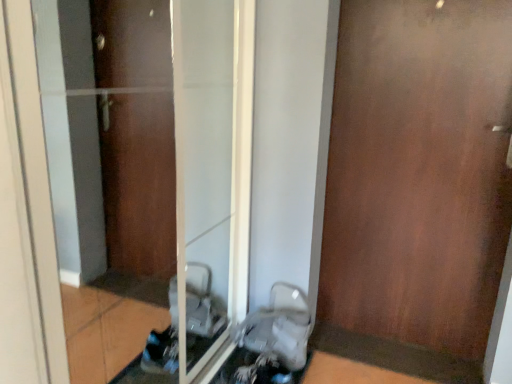
Question: Is the depth of transparent glass door at center greater than that of white plastic baby carriage at lower center?

Choices:
 (A) yes
 (B) no

Answer: (B)

Question: Does transparent glass door at center appear on the left side of white plastic baby carriage at lower center?

Choices:
 (A) yes
 (B) no

Answer: (A)

Question: Would you consider transparent glass door at center to be distant from white plastic baby carriage at lower center?

Choices:
 (A) no
 (B) yes

Answer: (A)

Question: Is transparent glass door at center bigger than white plastic baby carriage at lower center?

Choices:
 (A) yes
 (B) no

Answer: (A)

Question: Is transparent glass door at center facing away from white plastic baby carriage at lower center?

Choices:
 (A) no
 (B) yes

Answer: (B)

Question: From the image's perspective, relative to white plastic baby carriage at lower center, is transparent glass door at center above or below?

Choices:
 (A) below
 (B) above

Answer: (B)

Question: Is transparent glass door at center taller or shorter than white plastic baby carriage at lower center?

Choices:
 (A) tall
 (B) short

Answer: (A)

Question: Based on their positions, is transparent glass door at center located to the left or right of white plastic baby carriage at lower center?

Choices:
 (A) left
 (B) right

Answer: (A)

Question: From a real-world perspective, is transparent glass door at center physically located above or below white plastic baby carriage at lower center?

Choices:
 (A) above
 (B) below

Answer: (A)

Question: Looking at the image, does transparent glass door at center seem bigger or smaller compared to brown wood door at right?

Choices:
 (A) big
 (B) small

Answer: (B)

Question: From a real-world perspective, is transparent glass door at center physically located above or below brown wood door at right?

Choices:
 (A) below
 (B) above

Answer: (A)

Question: Which is correct: transparent glass door at center is inside brown wood door at right, or outside of it?

Choices:
 (A) inside
 (B) outside

Answer: (B)

Question: In the image, is transparent glass door at center positioned in front of or behind brown wood door at right?

Choices:
 (A) behind
 (B) front

Answer: (B)

Question: Choose the correct answer: Is brown wood door at right inside transparent glass door at center or outside it?

Choices:
 (A) outside
 (B) inside

Answer: (A)

Question: From the image's perspective, relative to transparent glass door at center, is brown wood door at right above or below?

Choices:
 (A) above
 (B) below

Answer: (A)